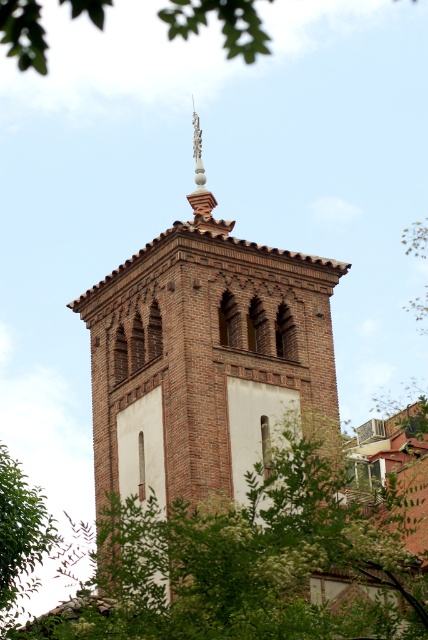
Can you confirm if brown brick tower at center is wider than green leafy tree at upper left?

No.

Who is more forward, (127, 352) or (180, 10)?

Point (180, 10) is in front.

Which is behind, point (282, 259) or point (74, 17)?

The point (74, 17) is behind.

Find the location of `brown brick tower at center`. brown brick tower at center is located at coordinates (205, 356).

Image resolution: width=428 pixels, height=640 pixels. What do you see at coordinates (205, 356) in the screenshot?
I see `brown brick tower at center` at bounding box center [205, 356].

Who is higher up, brown brick tower at center or green leafy tree at center?

brown brick tower at center is higher up.

Who is more distant from viewer, (244, 435) or (118, 618)?

The point (244, 435) is more distant.

Where is `brown brick tower at center`? brown brick tower at center is located at coordinates (205, 356).

Looking at this image, does green leafy tree at upper left appear under green leafy tree at lower left?

Actually, green leafy tree at upper left is above green leafy tree at lower left.

Is point (225, 38) closer to viewer compared to point (23, 595)?

Yes, point (225, 38) is in front of point (23, 595).

This screenshot has width=428, height=640. I want to click on green leafy tree at upper left, so click(x=222, y=22).